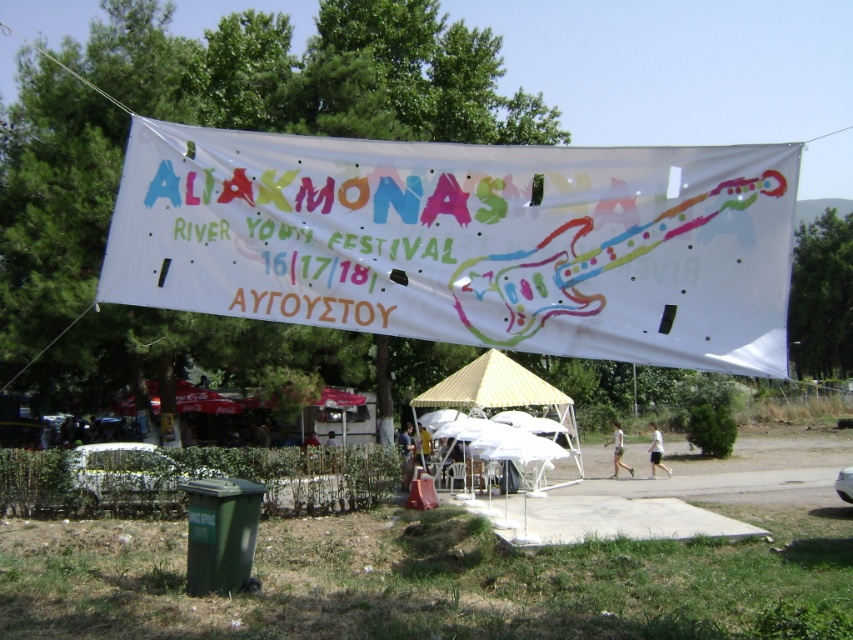
You are attending the Aliakmonas River Youth Festival and notice a white fabric canopy at center and a white cotton shirt at center. Which object is shorter in height?

The white fabric canopy at center is shorter than the white cotton shirt at center.

You are attending the Aliakmonas River Youth Festival and see two pieces of clothing in the crowd. The first is a white cotton shirt at center, and the second is a white cotton shorts at lower center. Which clothing item is positioned to the right of the other?

The white cotton shirt at center is to the right of the white cotton shorts at lower center.